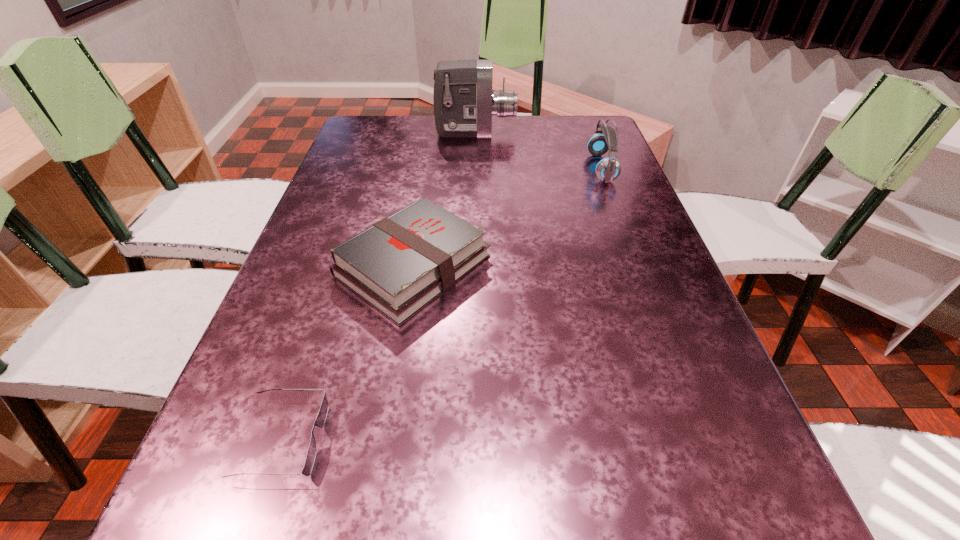
In order to click on free space at the left edge of the desktop in this screenshot , I will do `click(284, 497)`.

Locate an element on the screen. The image size is (960, 540). vacant space at the right edge is located at coordinates (641, 252).

In the image, there is a desktop. At what (x,y) coordinates should I click in order to perform the action: click on vacant space at the far left corner. Please return your answer as a coordinate pair (x, y). The width and height of the screenshot is (960, 540). Looking at the image, I should click on (362, 117).

Locate an element on the screen. This screenshot has width=960, height=540. vacant space at the far right corner of the desktop is located at coordinates 560,119.

Locate an element on the screen. free space between the second shortest object and the farthest object is located at coordinates (444, 199).

Locate an element on the screen. The height and width of the screenshot is (540, 960). free space between the camcorder and the third tallest object is located at coordinates (444, 199).

The width and height of the screenshot is (960, 540). Identify the location of free space between the nearest object and the second nearest object. (348, 353).

Locate an element on the screen. This screenshot has width=960, height=540. free area in between the third farthest object and the tallest object is located at coordinates (444, 199).

Locate an element on the screen. vacant space that is in between the rightmost object and the second nearest object is located at coordinates (507, 217).

What are the coordinates of `vacant area between the hardback book and the third shortest object` in the screenshot? It's located at (507, 217).